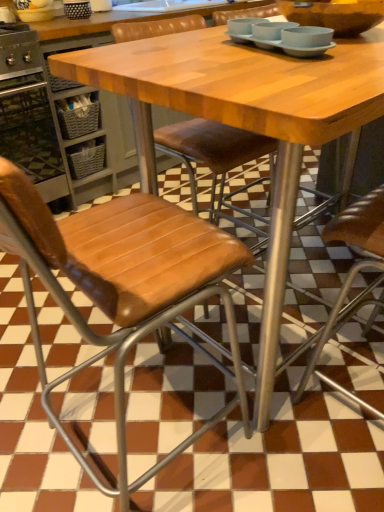
Question: Can you confirm if brown leather chair at center, which ranks as the 2th chair in left-to-right order, is positioned to the right of wooden table at center?

Choices:
 (A) yes
 (B) no

Answer: (A)

Question: Is brown leather chair at center, the 1th chair when ordered from right to left, positioned behind wooden table at center?

Choices:
 (A) yes
 (B) no

Answer: (A)

Question: Can you confirm if brown leather chair at center, the 1th chair when ordered from right to left, is positioned to the left of wooden table at center?

Choices:
 (A) yes
 (B) no

Answer: (B)

Question: From the image's perspective, is brown leather chair at center, which ranks as the 2th chair in left-to-right order, located above wooden table at center?

Choices:
 (A) no
 (B) yes

Answer: (B)

Question: From the image's perspective, does brown leather chair at center, which ranks as the 2th chair in left-to-right order, appear lower than wooden table at center?

Choices:
 (A) no
 (B) yes

Answer: (A)

Question: Considering the relative sizes of brown leather chair at center, the 1th chair when ordered from right to left, and wooden table at center in the image provided, is brown leather chair at center, the 1th chair when ordered from right to left, wider than wooden table at center?

Choices:
 (A) yes
 (B) no

Answer: (A)

Question: From a real-world perspective, does brushed metal oven at left stand above wooden table at center?

Choices:
 (A) yes
 (B) no

Answer: (B)

Question: Is brushed metal oven at left next to wooden table at center and touching it?

Choices:
 (A) yes
 (B) no

Answer: (B)

Question: Can you confirm if brushed metal oven at left is wider than wooden table at center?

Choices:
 (A) yes
 (B) no

Answer: (A)

Question: From the image's perspective, is brushed metal oven at left above wooden table at center?

Choices:
 (A) yes
 (B) no

Answer: (A)

Question: Would you say brushed metal oven at left is a long distance from wooden table at center?

Choices:
 (A) yes
 (B) no

Answer: (A)

Question: Could wooden table at center be considered to be inside brushed metal oven at left?

Choices:
 (A) no
 (B) yes

Answer: (A)

Question: Does light blue matte bowls at upper center appear on the right side of wooden table at center?

Choices:
 (A) no
 (B) yes

Answer: (B)